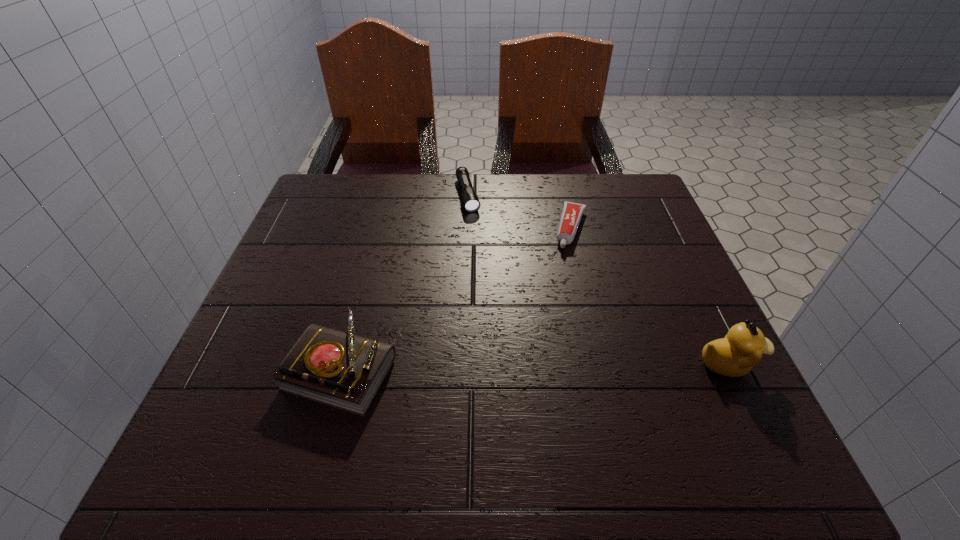
You are a GUI agent. You are given a task and a screenshot of the screen. Output one action in this format:
    pyautogui.click(x=<x>, y=<y>)
    Task: Click on the vacant space that is in between the diary and the third object from left to right
    This screenshot has width=960, height=540.
    Given the screenshot: What is the action you would take?
    pyautogui.click(x=456, y=298)

Find the location of a particular element. The height and width of the screenshot is (540, 960). vacant point located between the third object from right to left and the leftmost object is located at coordinates (404, 281).

The image size is (960, 540). I want to click on free space between the leftmost object and the shortest object, so click(456, 298).

Identify the location of vacant area that lies between the second object from right to left and the tallest object. The image size is (960, 540). (650, 296).

You are a GUI agent. You are given a task and a screenshot of the screen. Output one action in this format:
    pyautogui.click(x=<x>, y=<y>)
    Task: Click on the free space that is in between the third object from left to right and the rightmost object
    The height and width of the screenshot is (540, 960).
    Given the screenshot: What is the action you would take?
    click(x=650, y=296)

Where is `free point between the flashlight and the third shortest object`? The height and width of the screenshot is (540, 960). free point between the flashlight and the third shortest object is located at coordinates (404, 281).

Locate an element on the screen. This screenshot has height=540, width=960. unoccupied area between the duckling and the second object from left to right is located at coordinates (598, 279).

Where is `empty space that is in between the leftmost object and the tallest object`? empty space that is in between the leftmost object and the tallest object is located at coordinates (536, 366).

Find the location of a particular element. This screenshot has width=960, height=540. vacant region between the leftmost object and the second object from left to right is located at coordinates (404, 281).

This screenshot has height=540, width=960. I want to click on object identified as the closest to the second object from left to right, so click(x=572, y=212).